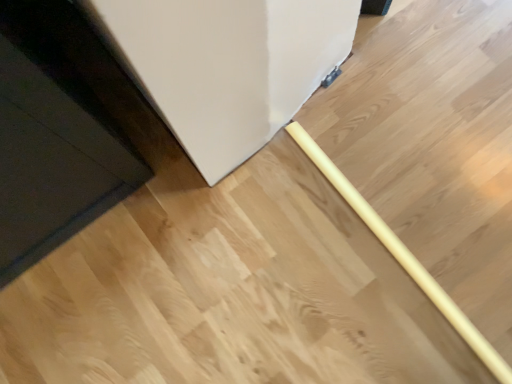
Describe the element at coordinates (52, 142) in the screenshot. I see `black glossy door at lower left` at that location.

This screenshot has width=512, height=384. Find the location of `black glossy door at lower left`. black glossy door at lower left is located at coordinates (52, 142).

What is the approximate height of yellow wood rolling pin at center?

yellow wood rolling pin at center is 1.34 inches tall.

I want to click on yellow wood rolling pin at center, so click(403, 256).

The height and width of the screenshot is (384, 512). What do you see at coordinates (403, 256) in the screenshot?
I see `yellow wood rolling pin at center` at bounding box center [403, 256].

Locate an element on the screen. black glossy door at lower left is located at coordinates (52, 142).

Consider the image. Which object is positioned more to the right, black glossy door at lower left or yellow wood rolling pin at center?

From the viewer's perspective, yellow wood rolling pin at center appears more on the right side.

Does black glossy door at lower left come behind yellow wood rolling pin at center?

No.

Which is less distant, [91,104] or [475,339]?

Point [91,104] is farther from the camera than point [475,339].

From the image's perspective, between black glossy door at lower left and yellow wood rolling pin at center, which one is located above?

From the image's view, black glossy door at lower left is above.

From a real-world perspective, which is physically below, black glossy door at lower left or yellow wood rolling pin at center?

yellow wood rolling pin at center is physically lower.

Does black glossy door at lower left have a lesser width compared to yellow wood rolling pin at center?

No.

Based on the photo, from their relative heights in the image, would you say black glossy door at lower left is taller or shorter than yellow wood rolling pin at center?

Considering their sizes, black glossy door at lower left has more height than yellow wood rolling pin at center.

Considering the sizes of black glossy door at lower left and yellow wood rolling pin at center in the image, is black glossy door at lower left bigger or smaller than yellow wood rolling pin at center?

Considering their sizes, black glossy door at lower left takes up more space than yellow wood rolling pin at center.

Would you say black glossy door at lower left is inside or outside yellow wood rolling pin at center?

black glossy door at lower left exists outside the volume of yellow wood rolling pin at center.

Can you see black glossy door at lower left touching yellow wood rolling pin at center?

No, black glossy door at lower left is not beside yellow wood rolling pin at center.

Is yellow wood rolling pin at center at the back of black glossy door at lower left?

No, black glossy door at lower left is not facing the opposite direction of yellow wood rolling pin at center.

What's the angular difference between black glossy door at lower left and yellow wood rolling pin at center's facing directions?

89.7 degrees separate the facing orientations of black glossy door at lower left and yellow wood rolling pin at center.

How far apart are black glossy door at lower left and yellow wood rolling pin at center?

They are 22.10 inches apart.

Locate an element on the screen. Image resolution: width=512 pixels, height=384 pixels. rolling pin behind the black glossy door at lower left is located at coordinates (403, 256).

Is yellow wood rolling pin at center to the left or to the right of black glossy door at lower left in the image?

Clearly, yellow wood rolling pin at center is on the right of black glossy door at lower left in the image.

Looking at this image, which object is closer to the camera taking this photo, yellow wood rolling pin at center or black glossy door at lower left?

black glossy door at lower left is in front.

Considering the positions of points (326, 158) and (79, 132), is point (326, 158) farther from camera compared to point (79, 132)?

Yes, it is.

From the image's perspective, is yellow wood rolling pin at center positioned above or below black glossy door at lower left?

Based on their image positions, yellow wood rolling pin at center is located beneath black glossy door at lower left.

From the picture: From a real-world perspective, is yellow wood rolling pin at center over black glossy door at lower left?

Incorrect, from a real-world perspective, yellow wood rolling pin at center is lower than black glossy door at lower left.

Is yellow wood rolling pin at center thinner than black glossy door at lower left?

Indeed, yellow wood rolling pin at center has a lesser width compared to black glossy door at lower left.

Between yellow wood rolling pin at center and black glossy door at lower left, which one has less height?

With less height is yellow wood rolling pin at center.

Between yellow wood rolling pin at center and black glossy door at lower left, which one has smaller size?

Smaller between the two is yellow wood rolling pin at center.

Is yellow wood rolling pin at center outside of black glossy door at lower left?

Yes.

Would you say yellow wood rolling pin at center is a long distance from black glossy door at lower left?

That's not correct — yellow wood rolling pin at center is a little close to black glossy door at lower left.

Could you tell me if yellow wood rolling pin at center is facing black glossy door at lower left?

No, yellow wood rolling pin at center is not turned towards black glossy door at lower left.

How many degrees apart are the facing directions of yellow wood rolling pin at center and black glossy door at lower left?

yellow wood rolling pin at center and black glossy door at lower left are facing 89.7 degrees away from each other.

Find the location of `door in front of the yellow wood rolling pin at center`. door in front of the yellow wood rolling pin at center is located at coordinates (52, 142).

What are the coordinates of `door located above the yellow wood rolling pin at center (from the image's perspective)` in the screenshot? It's located at (52, 142).

I want to click on rolling pin below the black glossy door at lower left (from a real-world perspective), so click(x=403, y=256).